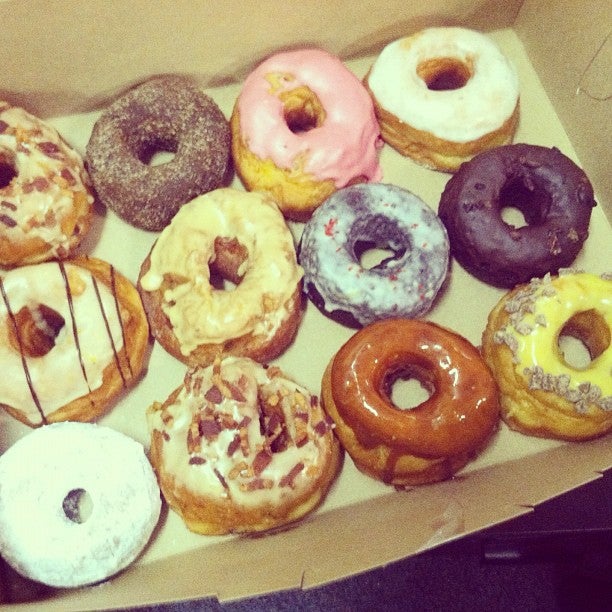
Find the location of `box`. box is located at coordinates (564, 122).